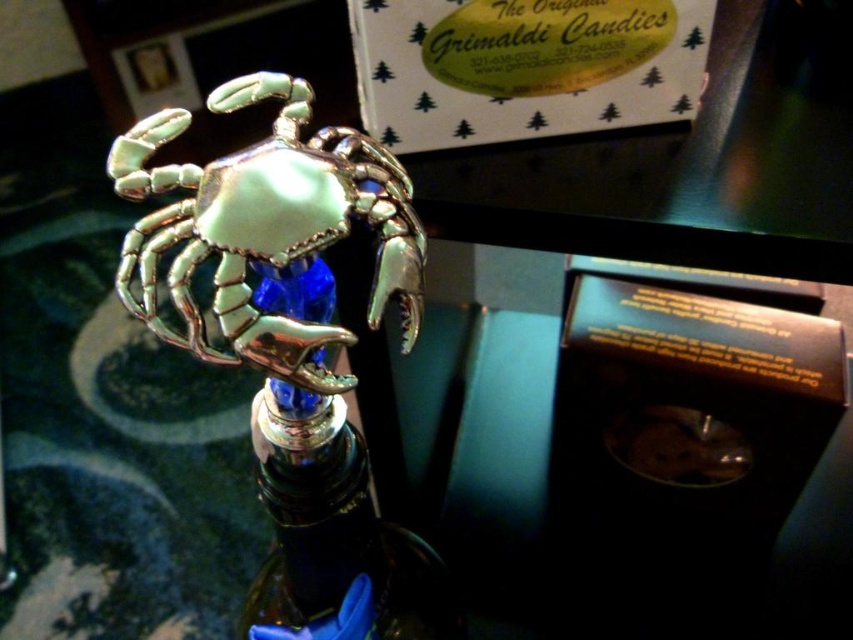
Based on the scene description, where exactly is the shiny silver crab at center located in terms of coordinates?

The shiny silver crab at center is located at coordinates point (267, 227).

You are trying to determine if the shiny silver crab at center can fit entirely within the metallic blue glass bottle at center. Based on their sizes, what is your conclusion?

The shiny silver crab at center is smaller in width than the metallic blue glass bottle at center, so it can fit inside the bottle.

You are examining the decorative crab bottle stopper on the dark green glass bottle. There are two points marked on the stopper. One is at coordinate point (x=273, y=356) and the other is at point (x=358, y=464). Which point is closer to your eyes as you look at the bottle?

Point (x=273, y=356) is closer to the camera than point (x=358, y=464).